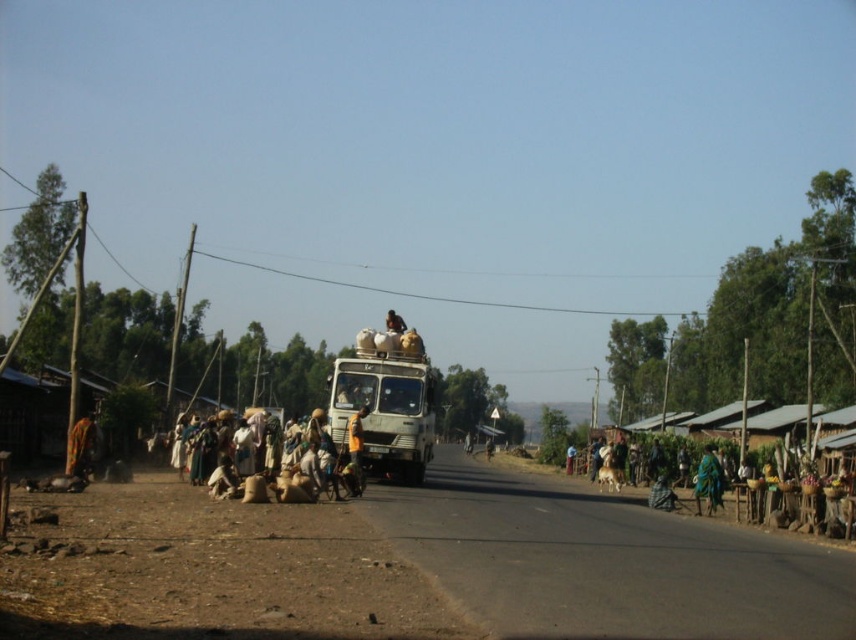
Can you confirm if green matte truck at center is taller than teal fabric person at lower right?

Correct, green matte truck at center is much taller as teal fabric person at lower right.

Can you confirm if green matte truck at center is positioned above teal fabric person at lower right?

Indeed, green matte truck at center is positioned over teal fabric person at lower right.

The width and height of the screenshot is (856, 640). Describe the element at coordinates (385, 412) in the screenshot. I see `green matte truck at center` at that location.

At what (x,y) coordinates should I click in order to perform the action: click on green matte truck at center. Please return your answer as a coordinate pair (x, y). Image resolution: width=856 pixels, height=640 pixels. Looking at the image, I should click on (385, 412).

Who is more forward, [417,419] or [360,474]?

Point [360,474] is more forward.

Can you confirm if green matte truck at center is thinner than orange fabric person at center?

In fact, green matte truck at center might be wider than orange fabric person at center.

Is point (400, 392) behind point (357, 461)?

Yes, point (400, 392) is farther from viewer.

Where is `green matte truck at center`? The height and width of the screenshot is (640, 856). green matte truck at center is located at coordinates (385, 412).

Between brown fabric person at lower left and teal fabric person at lower right, which one appears on the right side from the viewer's perspective?

Positioned to the right is teal fabric person at lower right.

Who is shorter, brown fabric person at lower left or teal fabric person at lower right?

With less height is brown fabric person at lower left.

What do you see at coordinates (81, 445) in the screenshot? I see `brown fabric person at lower left` at bounding box center [81, 445].

You are a GUI agent. You are given a task and a screenshot of the screen. Output one action in this format:
    pyautogui.click(x=<x>, y=<y>)
    Task: Click on the brown fabric person at lower left
    
    Given the screenshot: What is the action you would take?
    pyautogui.click(x=81, y=445)